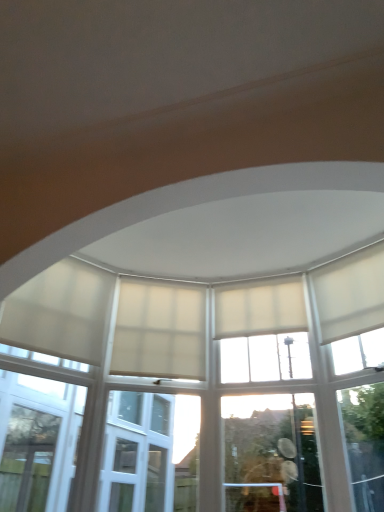
Question: Which direction should I rotate to look at white matte curtain at center, which ranks as the third curtain in left-to-right order, — up or down?

Choices:
 (A) down
 (B) up

Answer: (A)

Question: Does white matte curtain at upper right, placed as the 1th curtain when sorted from right to left, have a lesser width compared to beige fabric curtain at center, the second curtain viewed from the left?

Choices:
 (A) no
 (B) yes

Answer: (A)

Question: Is white matte curtain at upper right, which appears as the 4th curtain when viewed from the left, shorter than beige fabric curtain at center, the second curtain viewed from the left?

Choices:
 (A) no
 (B) yes

Answer: (B)

Question: Does white matte curtain at upper right, placed as the 1th curtain when sorted from right to left, contain beige fabric curtain at center, the 3th curtain when ordered from right to left?

Choices:
 (A) yes
 (B) no

Answer: (B)

Question: From the image's perspective, is white matte curtain at upper right, which appears as the 4th curtain when viewed from the left, on top of beige fabric curtain at center, the second curtain viewed from the left?

Choices:
 (A) no
 (B) yes

Answer: (B)

Question: Is white matte curtain at upper right, placed as the 1th curtain when sorted from right to left, to the left of beige fabric curtain at center, the second curtain viewed from the left, from the viewer's perspective?

Choices:
 (A) yes
 (B) no

Answer: (B)

Question: From the image's perspective, does white matte curtain at upper right, placed as the 1th curtain when sorted from right to left, appear lower than beige fabric curtain at center, the second curtain viewed from the left?

Choices:
 (A) no
 (B) yes

Answer: (A)

Question: Is white matte curtain at upper right, placed as the 1th curtain when sorted from right to left, placed right next to white matte curtain at center, which is the second curtain from right to left?

Choices:
 (A) no
 (B) yes

Answer: (A)

Question: Is white matte curtain at center, which ranks as the third curtain in left-to-right order, completely or partially inside white matte curtain at upper right, which appears as the 4th curtain when viewed from the left?

Choices:
 (A) yes
 (B) no

Answer: (B)

Question: Does white matte curtain at upper right, which appears as the 4th curtain when viewed from the left, have a smaller size compared to white matte curtain at center, which is the second curtain from right to left?

Choices:
 (A) no
 (B) yes

Answer: (B)

Question: Could you tell me if white matte curtain at upper right, placed as the 1th curtain when sorted from right to left, is facing white matte curtain at center, which ranks as the third curtain in left-to-right order?

Choices:
 (A) no
 (B) yes

Answer: (A)

Question: Can you confirm if white matte curtain at upper right, which appears as the 4th curtain when viewed from the left, is positioned to the left of white matte curtain at center, which is the second curtain from right to left?

Choices:
 (A) yes
 (B) no

Answer: (B)

Question: From the image's perspective, would you say white matte curtain at upper right, placed as the 1th curtain when sorted from right to left, is positioned over white matte curtain at center, which ranks as the third curtain in left-to-right order?

Choices:
 (A) no
 (B) yes

Answer: (B)

Question: Is white matte curtain at upper right, placed as the 1th curtain when sorted from right to left, located within beige fabric curtain at center, the second curtain viewed from the left?

Choices:
 (A) no
 (B) yes

Answer: (A)